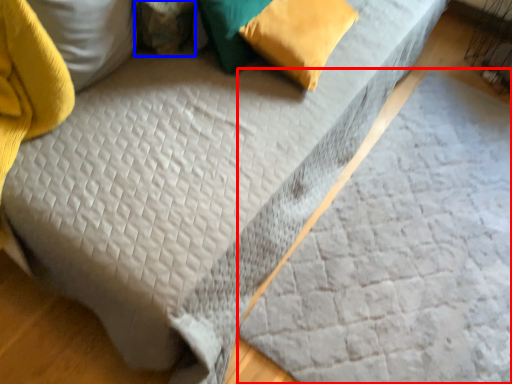
Question: Among these objects, which one is farthest to the camera, sheet (highlighted by a red box) or pillow (highlighted by a blue box)?

Choices:
 (A) sheet
 (B) pillow

Answer: (B)